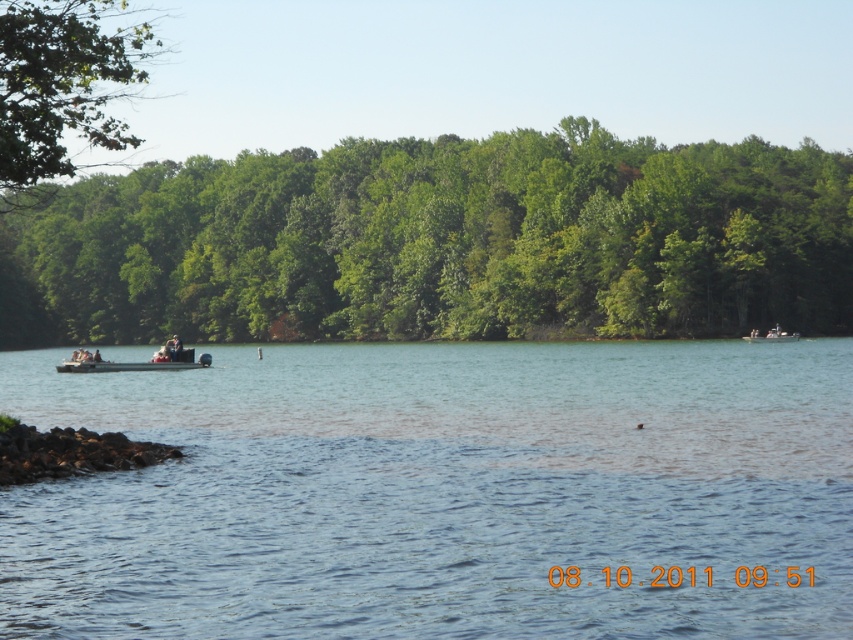
Question: Which object is closer to the camera taking this photo?

Choices:
 (A) green leafy tree at upper left
 (B) clear blue water at center
 (C) metallic gray boat at center
 (D) green leafy trees at center

Answer: (B)

Question: Does green leafy trees at center appear over green leafy tree at upper left?

Choices:
 (A) yes
 (B) no

Answer: (B)

Question: Is clear blue water at center positioned before green leafy tree at upper left?

Choices:
 (A) no
 (B) yes

Answer: (B)

Question: Which of the following is the farthest from the observer?

Choices:
 (A) (795, 422)
 (B) (128, 364)
 (C) (787, 337)
 (D) (120, 122)

Answer: (D)

Question: Can you confirm if green leafy trees at center is wider than metallic gray pontoon boat at left?

Choices:
 (A) yes
 (B) no

Answer: (A)

Question: Among these points, which one is nearest to the camera?

Choices:
 (A) (67, 60)
 (B) (682, 260)
 (C) (781, 337)
 (D) (675, 474)

Answer: (D)